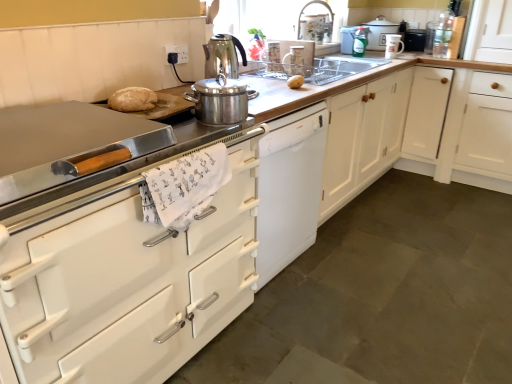
Identify the location of vacant region to the left of yellow matte potato at center. (261, 81).